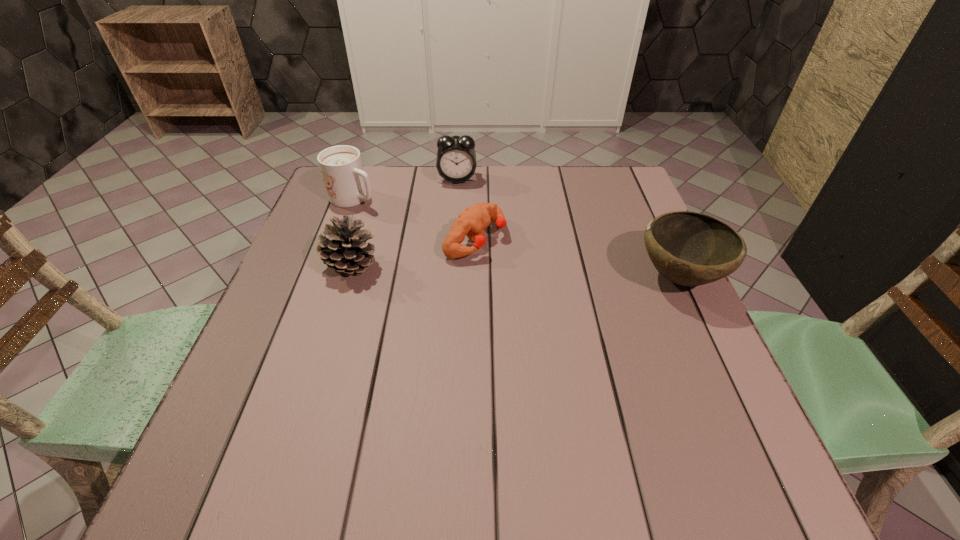
Locate an element on the screen. free spot between the shortest object and the cappuccino is located at coordinates (415, 218).

Locate an element on the screen. The width and height of the screenshot is (960, 540). vacant area between the pinecone and the rightmost object is located at coordinates click(515, 272).

Locate an element on the screen. Image resolution: width=960 pixels, height=540 pixels. free point between the pinecone and the farthest object is located at coordinates (404, 222).

The image size is (960, 540). In order to click on free spot between the second farthest object and the shortest object in this screenshot , I will do click(415, 218).

At what (x,y) coordinates should I click in order to perform the action: click on free spot between the puncher and the fourth nearest object. Please return your answer as a coordinate pair (x, y). The width and height of the screenshot is (960, 540). Looking at the image, I should click on (415, 218).

Identify which object is located as the third nearest to the farthest object. Please provide its 2D coordinates. Your answer should be formatted as a tuple, i.e. [(x, y)], where the tuple contains the x and y coordinates of a point satisfying the conditions above.

[(343, 248)]

Locate an element on the screen. The image size is (960, 540). object that stands as the closest to the cappuccino is located at coordinates click(x=343, y=248).

At what (x,y) coordinates should I click in order to perform the action: click on blank area in the image that satisfies the following two spatial constraints: 1. on the front side of the farthest object; 2. on the right side of the puncher. Please return your answer as a coordinate pair (x, y). Looking at the image, I should click on (453, 239).